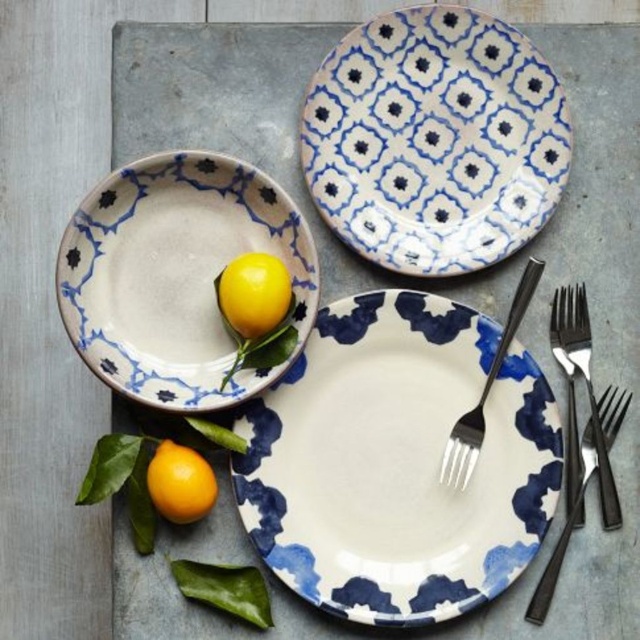
Question: Which point is closer to the camera taking this photo?

Choices:
 (A) (246, 323)
 (B) (163, 445)
 (C) (372, 33)
 (D) (579, 461)

Answer: (A)

Question: Which object is closer to the camera taking this photo?

Choices:
 (A) black metallic fork at center
 (B) blue and white ceramic plate at upper center
 (C) yellow matte lemon at center-left

Answer: (C)

Question: Can you confirm if white glossy plate at center is positioned below matte ceramic bowl at upper left?

Choices:
 (A) no
 (B) yes

Answer: (B)

Question: Can you confirm if white glossy plate at center is positioned to the left of blue and white ceramic plate at upper center?

Choices:
 (A) yes
 (B) no

Answer: (A)

Question: Is matte ceramic bowl at upper left to the right of black metallic fork at center from the viewer's perspective?

Choices:
 (A) no
 (B) yes

Answer: (A)

Question: Which object is closer to the camera taking this photo?

Choices:
 (A) yellow matte lemon at lower left
 (B) blue and white ceramic plate at upper center
 (C) black metallic fork at lower right

Answer: (A)